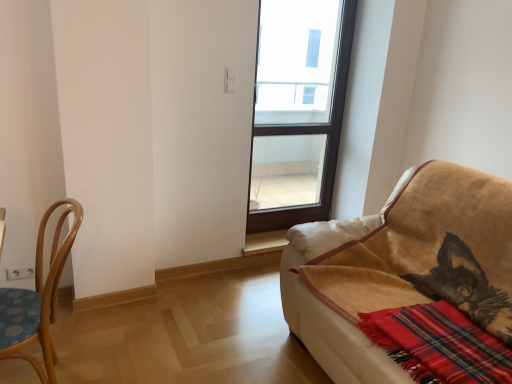
What is the approximate width of light brown wood chair at left?

light brown wood chair at left is 15.12 inches in width.

The image size is (512, 384). What do you see at coordinates (439, 344) in the screenshot?
I see `red plaid blanket at lower right` at bounding box center [439, 344].

At what (x,y) coordinates should I click in order to perform the action: click on velvet beige couch at right. Please return your answer as a coordinate pair (x, y). Image resolution: width=512 pixels, height=384 pixels. Looking at the image, I should click on (x=401, y=266).

Locate an element on the screen. light brown wood chair at left is located at coordinates (38, 298).

Based on the photo, which object is further away from the camera, red plaid blanket at lower right or transparent glass window at center?

transparent glass window at center is more distant.

Which of these two, red plaid blanket at lower right or transparent glass window at center, stands taller?

transparent glass window at center.

Between red plaid blanket at lower right and transparent glass window at center, which one has larger width?

red plaid blanket at lower right.

From the image's perspective, which one is positioned lower, transparent glass window at center or light brown wood chair at left?

From the image's view, light brown wood chair at left is below.

Who is shorter, transparent glass window at center or light brown wood chair at left?

With less height is light brown wood chair at left.

Between transparent glass window at center and light brown wood chair at left, which one is positioned behind?

transparent glass window at center is more distant.

Considering the sizes of transparent glass window at center and light brown wood chair at left in the image, is transparent glass window at center wider or thinner than light brown wood chair at left?

Clearly, transparent glass window at center has less width compared to light brown wood chair at left.

Between transparent glass window at center and velvet beige couch at right, which one has larger width?

velvet beige couch at right.

From the image's perspective, which object appears higher, transparent glass window at center or velvet beige couch at right?

transparent glass window at center appears higher in the image.

Which of these two, transparent glass window at center or velvet beige couch at right, stands taller?

With more height is transparent glass window at center.

From a real-world perspective, is transparent glass window at center over velvet beige couch at right?

Yes, from a real-world perspective, transparent glass window at center is on top of velvet beige couch at right.

Does point (501, 366) come farther from viewer compared to point (21, 309)?

No, (501, 366) is closer to viewer.

In terms of height, does red plaid blanket at lower right look taller or shorter compared to light brown wood chair at left?

In the image, red plaid blanket at lower right appears to be shorter than light brown wood chair at left.

From the image's perspective, relative to light brown wood chair at left, is red plaid blanket at lower right above or below?

From the image's perspective, red plaid blanket at lower right appears below light brown wood chair at left.

Is red plaid blanket at lower right further to the viewer compared to light brown wood chair at left?

No, the depth of red plaid blanket at lower right is less than that of light brown wood chair at left.

Which of these two, velvet beige couch at right or red plaid blanket at lower right, is smaller?

With smaller size is red plaid blanket at lower right.

From the picture: Who is more distant, velvet beige couch at right or red plaid blanket at lower right?

red plaid blanket at lower right is more distant.

From the image's perspective, which object appears higher, velvet beige couch at right or red plaid blanket at lower right?

velvet beige couch at right, from the image's perspective.

Can you confirm if velvet beige couch at right is taller than transparent glass window at center?

No, velvet beige couch at right is not taller than transparent glass window at center.

Considering the relative positions of velvet beige couch at right and transparent glass window at center in the image provided, is velvet beige couch at right behind transparent glass window at center?

No, it is in front of transparent glass window at center.

Considering the positions of point (437, 283) and point (251, 216), is point (437, 283) closer or farther from the camera than point (251, 216)?

Point (437, 283).

This screenshot has height=384, width=512. Identify the location of window located above the velvet beige couch at right (from a real-world perspective). (298, 109).

Is light brown wood chair at left in front of velvet beige couch at right?

No, light brown wood chair at left is further to the viewer.

Is light brown wood chair at left surrounding velvet beige couch at right?

No, velvet beige couch at right is located outside of light brown wood chair at left.

From the image's perspective, is light brown wood chair at left located above or below velvet beige couch at right?

Based on their image positions, light brown wood chair at left is located beneath velvet beige couch at right.

Based on their sizes in the image, would you say light brown wood chair at left is bigger or smaller than velvet beige couch at right?

Clearly, light brown wood chair at left is smaller in size than velvet beige couch at right.

Where is `window above the red plaid blanket at lower right (from the image's perspective)`? This screenshot has width=512, height=384. window above the red plaid blanket at lower right (from the image's perspective) is located at coordinates (298, 109).

This screenshot has width=512, height=384. In the image, there is a transparent glass window at center. Identify the location of chair below it (from the image's perspective). (38, 298).

Looking at the image, which one is located further to red plaid blanket at lower right, transparent glass window at center or velvet beige couch at right?

transparent glass window at center lies further to red plaid blanket at lower right than the other object.

When comparing their distances from light brown wood chair at left, does red plaid blanket at lower right or transparent glass window at center seem closer?

Based on the image, red plaid blanket at lower right appears to be nearer to light brown wood chair at left.

From the picture: Based on their spatial positions, is velvet beige couch at right or light brown wood chair at left closer to red plaid blanket at lower right?

The object closer to red plaid blanket at lower right is velvet beige couch at right.

Estimate the real-world distances between objects in this image. Which object is further from red plaid blanket at lower right, velvet beige couch at right or transparent glass window at center?

The object further to red plaid blanket at lower right is transparent glass window at center.

When comparing their distances from light brown wood chair at left, does red plaid blanket at lower right or velvet beige couch at right seem further?

Among the two, red plaid blanket at lower right is located further to light brown wood chair at left.

From the image, which object appears to be farther from velvet beige couch at right, transparent glass window at center or red plaid blanket at lower right?

The object further to velvet beige couch at right is transparent glass window at center.

Estimate the real-world distances between objects in this image. Which object is further from light brown wood chair at left, transparent glass window at center or red plaid blanket at lower right?

transparent glass window at center is further to light brown wood chair at left.

Looking at the image, which one is located further to velvet beige couch at right, light brown wood chair at left or red plaid blanket at lower right?

light brown wood chair at left is further to velvet beige couch at right.

Find the location of `window between light brown wood chair at left and red plaid blanket at lower right in the horizontal direction`. window between light brown wood chair at left and red plaid blanket at lower right in the horizontal direction is located at coordinates (298, 109).

Identify the location of plaid located between light brown wood chair at left and velvet beige couch at right in the left-right direction. (439, 344).

The width and height of the screenshot is (512, 384). I want to click on plaid between velvet beige couch at right and transparent glass window at center in the front-back direction, so click(439, 344).

You are a GUI agent. You are given a task and a screenshot of the screen. Output one action in this format:
    pyautogui.click(x=<x>, y=<y>)
    Task: Click on the chair between velvet beige couch at right and transparent glass window at center along the z-axis
    This screenshot has width=512, height=384.
    Given the screenshot: What is the action you would take?
    pyautogui.click(x=38, y=298)